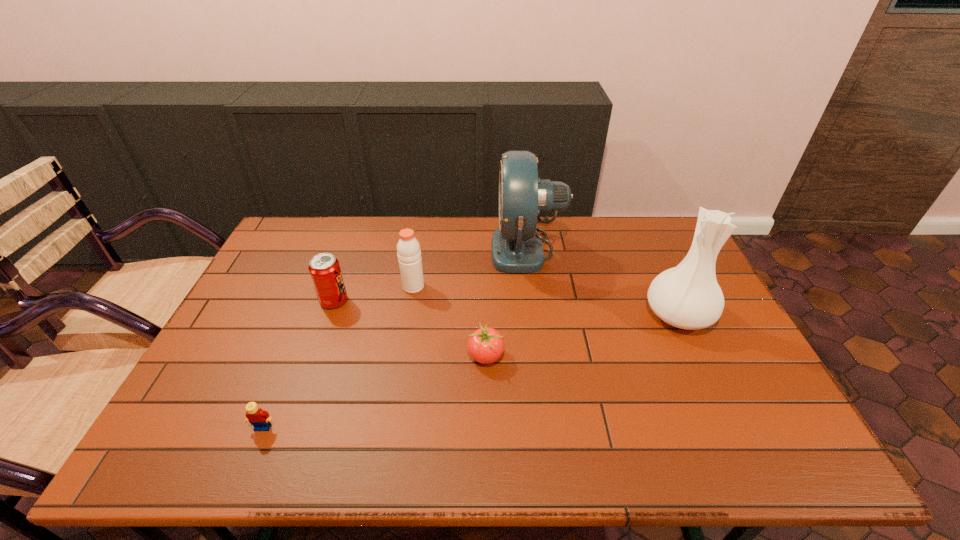
Identify the location of vacant space in between the third object from left to right and the second nearest object. The height and width of the screenshot is (540, 960). (449, 321).

Locate an element on the screen. unoccupied area between the fifth farthest object and the rightmost object is located at coordinates (582, 335).

What are the coordinates of `vacant area that lies between the shaker and the vase` in the screenshot? It's located at pyautogui.click(x=546, y=301).

At what (x,y) coordinates should I click in order to perform the action: click on the closest object to the vase. Please return your answer as a coordinate pair (x, y). The image size is (960, 540). Looking at the image, I should click on (516, 247).

Locate an element on the screen. object that is the fifth closest to the third shortest object is located at coordinates (687, 296).

Locate an element on the screen. The height and width of the screenshot is (540, 960). free location that satisfies the following two spatial constraints: 1. in front of the fan to blow air; 2. on the front-facing side of the nearest object is located at coordinates (551, 427).

You are a GUI agent. You are given a task and a screenshot of the screen. Output one action in this format:
    pyautogui.click(x=<x>, y=<y>)
    Task: Click on the free space that satisfies the following two spatial constraints: 1. on the back side of the fifth farthest object; 2. on the right side of the rightmost object
    This screenshot has width=960, height=540.
    Given the screenshot: What is the action you would take?
    pyautogui.click(x=486, y=315)

You are a GUI agent. You are given a task and a screenshot of the screen. Output one action in this format:
    pyautogui.click(x=<x>, y=<y>)
    Task: Click on the free space that satisfies the following two spatial constraints: 1. in front of the fan to blow air; 2. on the front-facing side of the nearest object
    The width and height of the screenshot is (960, 540).
    Given the screenshot: What is the action you would take?
    pyautogui.click(x=551, y=427)